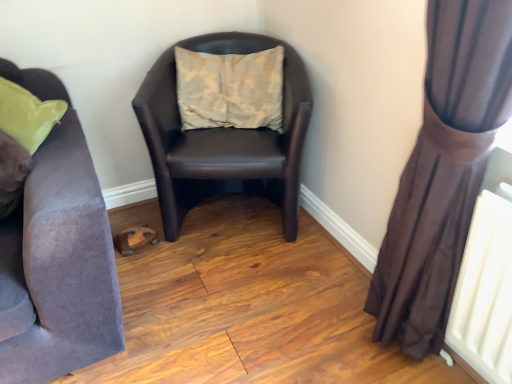
Question: Is brown sheer curtain at right to the right of beige fabric pillow at center from the viewer's perspective?

Choices:
 (A) no
 (B) yes

Answer: (B)

Question: From the image's perspective, is brown sheer curtain at right above beige fabric pillow at center?

Choices:
 (A) no
 (B) yes

Answer: (A)

Question: Considering the relative sizes of brown sheer curtain at right and beige fabric pillow at center in the image provided, is brown sheer curtain at right bigger than beige fabric pillow at center?

Choices:
 (A) no
 (B) yes

Answer: (B)

Question: Is brown sheer curtain at right in front of beige fabric pillow at center?

Choices:
 (A) yes
 (B) no

Answer: (A)

Question: Is brown sheer curtain at right behind beige fabric pillow at center?

Choices:
 (A) yes
 (B) no

Answer: (B)

Question: Is brown leather chair at center inside the boundaries of brown sheer curtain at right, or outside?

Choices:
 (A) inside
 (B) outside

Answer: (B)

Question: In terms of height, does brown leather chair at center look taller or shorter compared to brown sheer curtain at right?

Choices:
 (A) tall
 (B) short

Answer: (B)

Question: Considering the positions of brown leather chair at center and brown sheer curtain at right in the image, is brown leather chair at center wider or thinner than brown sheer curtain at right?

Choices:
 (A) thin
 (B) wide

Answer: (B)

Question: Considering the positions of brown leather chair at center and brown sheer curtain at right in the image, is brown leather chair at center bigger or smaller than brown sheer curtain at right?

Choices:
 (A) big
 (B) small

Answer: (A)

Question: Based on their sizes in the image, would you say beige fabric pillow at center is bigger or smaller than velvet purple couch at left?

Choices:
 (A) small
 (B) big

Answer: (A)

Question: Based on their positions, is beige fabric pillow at center located to the left or right of velvet purple couch at left?

Choices:
 (A) right
 (B) left

Answer: (A)

Question: From the image's perspective, is beige fabric pillow at center located above or below velvet purple couch at left?

Choices:
 (A) below
 (B) above

Answer: (B)

Question: From their relative heights in the image, would you say beige fabric pillow at center is taller or shorter than velvet purple couch at left?

Choices:
 (A) short
 (B) tall

Answer: (A)

Question: From a real-world perspective, is beige fabric pillow at center positioned above or below brown sheer curtain at right?

Choices:
 (A) above
 (B) below

Answer: (A)

Question: Is beige fabric pillow at center bigger or smaller than brown sheer curtain at right?

Choices:
 (A) small
 (B) big

Answer: (A)